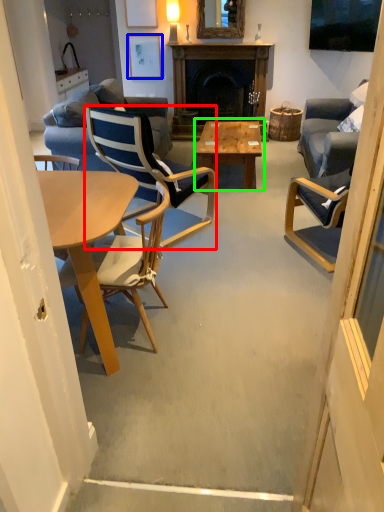
Question: Based on their relative distances, which object is nearer to chair (highlighted by a red box)? Choose from picture frame (highlighted by a blue box) and coffee table (highlighted by a green box).

Choices:
 (A) picture frame
 (B) coffee table

Answer: (B)